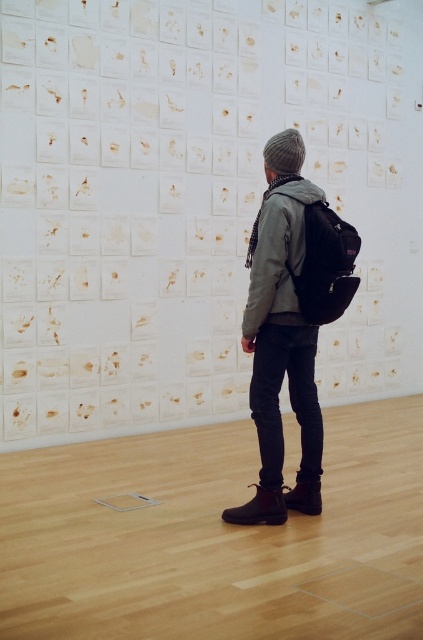
Question: Can you confirm if matte paper wall at center is thinner than matte gray jacket at center?

Choices:
 (A) no
 (B) yes

Answer: (A)

Question: Which object is farther from the camera taking this photo?

Choices:
 (A) matte black backpack at center
 (B) matte paper wall at center
 (C) matte gray jacket at center

Answer: (B)

Question: Estimate the real-world distances between objects in this image. Which object is closer to the matte paper wall at center?

Choices:
 (A) matte black backpack at center
 (B) matte gray jacket at center

Answer: (B)

Question: Which of the following is the closest to the observer?

Choices:
 (A) (269, 268)
 (B) (343, 273)

Answer: (A)

Question: Is matte paper wall at center thinner than matte black backpack at center?

Choices:
 (A) no
 (B) yes

Answer: (A)

Question: Is matte paper wall at center wider than matte black backpack at center?

Choices:
 (A) no
 (B) yes

Answer: (B)